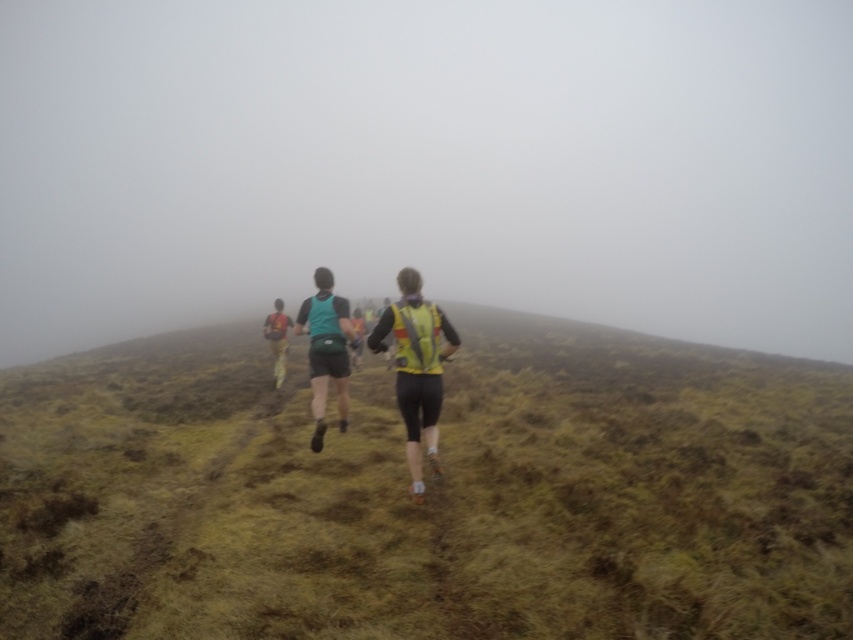
Between point (436, 472) and point (276, 355), which one is positioned behind?

The point (276, 355) is behind.

The image size is (853, 640). What do you see at coordinates (416, 368) in the screenshot?
I see `reflective yellow vest at center` at bounding box center [416, 368].

Image resolution: width=853 pixels, height=640 pixels. In order to click on reflective yellow vest at center in this screenshot , I will do `click(416, 368)`.

Who is positioned more to the right, green grassy at center or yellow reflective vest at center?

From the viewer's perspective, green grassy at center appears more on the right side.

Who is shorter, green grassy at center or yellow reflective vest at center?

With less height is green grassy at center.

Identify the location of green grassy at center. The width and height of the screenshot is (853, 640). (428, 493).

Can you confirm if green grassy at center is smaller than reflective yellow vest at center?

No, green grassy at center is not smaller than reflective yellow vest at center.

What do you see at coordinates (428, 493) in the screenshot? The width and height of the screenshot is (853, 640). I see `green grassy at center` at bounding box center [428, 493].

What are the coordinates of `green grassy at center` in the screenshot? It's located at (428, 493).